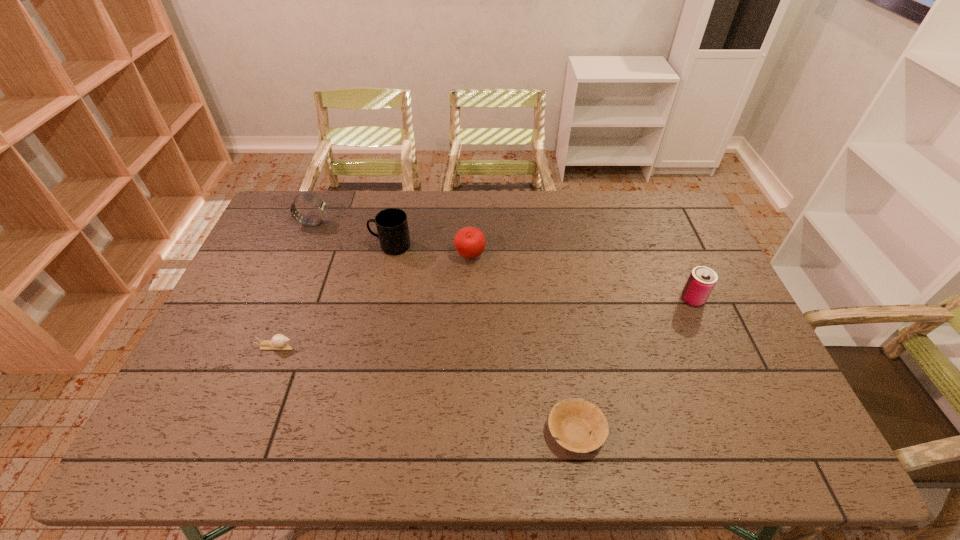
Locate an element on the screen. the fourth object from right to left is located at coordinates (392, 226).

Identify the location of the farthest object. The height and width of the screenshot is (540, 960). (321, 205).

Locate an element on the screen. The height and width of the screenshot is (540, 960). the third object from right to left is located at coordinates (470, 242).

This screenshot has width=960, height=540. In order to click on the rightmost object in this screenshot , I will do tap(702, 280).

Image resolution: width=960 pixels, height=540 pixels. What are the coordinates of `the fourth farthest object` in the screenshot? It's located at (702, 280).

Where is `the fifth farthest object`? the fifth farthest object is located at coordinates (279, 342).

Locate an element on the screen. The height and width of the screenshot is (540, 960). bowl is located at coordinates (577, 425).

The height and width of the screenshot is (540, 960). What are the coordinates of `the nearest object` in the screenshot? It's located at (577, 425).

You are a GUI agent. You are given a task and a screenshot of the screen. Output one action in this format:
    pyautogui.click(x=<x>, y=<y>)
    Task: Click on the vacant point located on the side of the fourth object from right to left with the handle
    
    Given the screenshot: What is the action you would take?
    pyautogui.click(x=298, y=246)

The height and width of the screenshot is (540, 960). I want to click on free location located 0.190m on the side of the fourth object from right to left with the handle, so click(x=315, y=246).